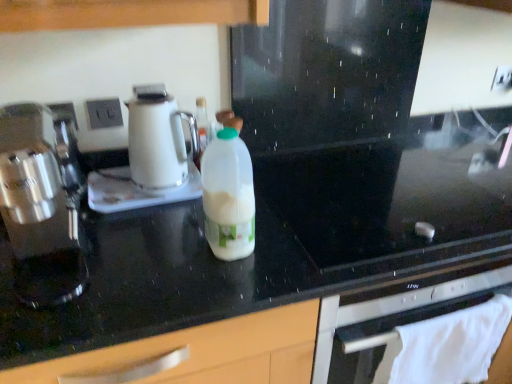
This screenshot has width=512, height=384. I want to click on space that is in front of white plastic bottle at center, so click(x=215, y=284).